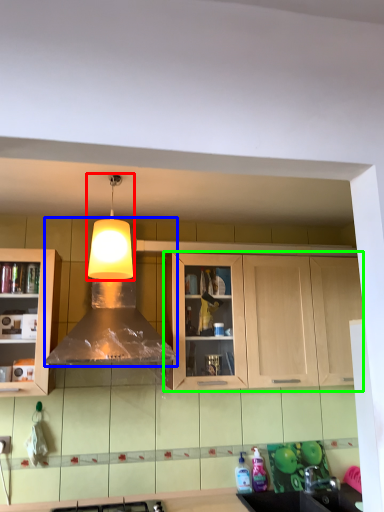
Question: Based on their relative distances, which object is nearer to light fixture (highlighted by a red box)? Choose from hood (highlighted by a blue box) and cabinetry (highlighted by a green box).

Choices:
 (A) hood
 (B) cabinetry

Answer: (A)